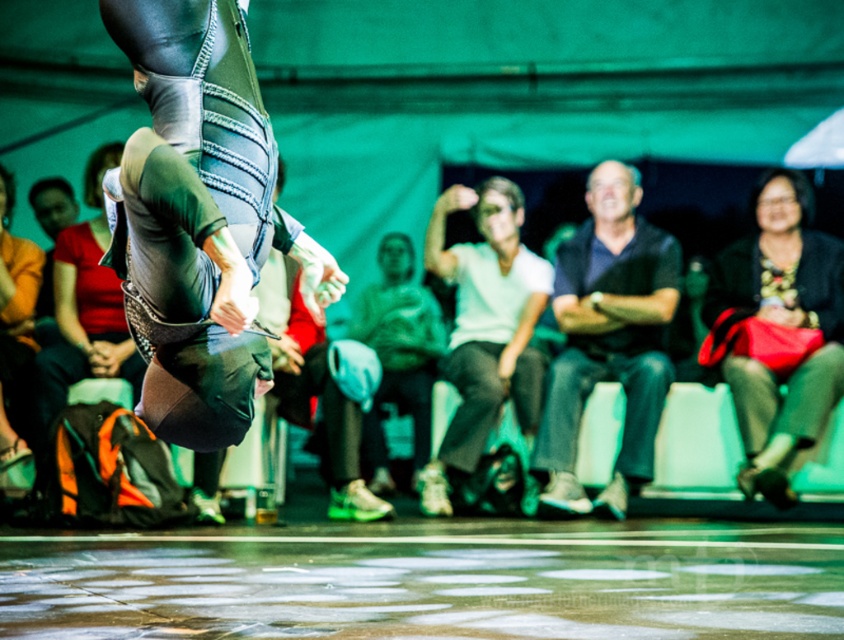
Question: Among these objects, which one is nearest to the camera?

Choices:
 (A) orange fabric at lower left
 (B) dark blue shirt at center

Answer: (A)

Question: Does white matte shirt at center appear on the left side of orange fabric at lower left?

Choices:
 (A) yes
 (B) no

Answer: (B)

Question: Is matte black sweater at right smaller than orange fabric at lower left?

Choices:
 (A) yes
 (B) no

Answer: (A)

Question: Observing the image, what is the correct spatial positioning of dark blue shirt at center in reference to matte black sweater at right?

Choices:
 (A) above
 (B) below

Answer: (B)

Question: Which point is closer to the camera?

Choices:
 (A) (523, 435)
 (B) (812, 410)

Answer: (B)

Question: Which of these objects is positioned farthest from the orange fabric at lower left?

Choices:
 (A) matte black sweater at right
 (B) white matte shirt at center

Answer: (A)